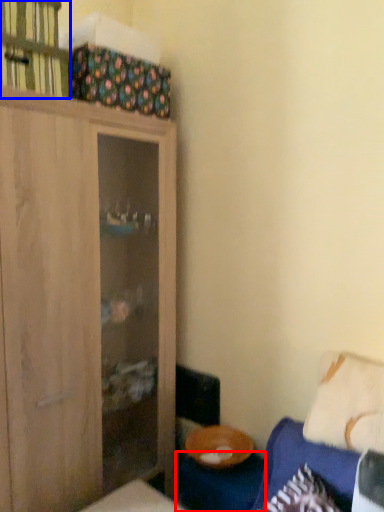
Question: Which of the following is the closest to the observer, table (highlighted by a red box) or cabinet (highlighted by a blue box)?

Choices:
 (A) table
 (B) cabinet

Answer: (B)